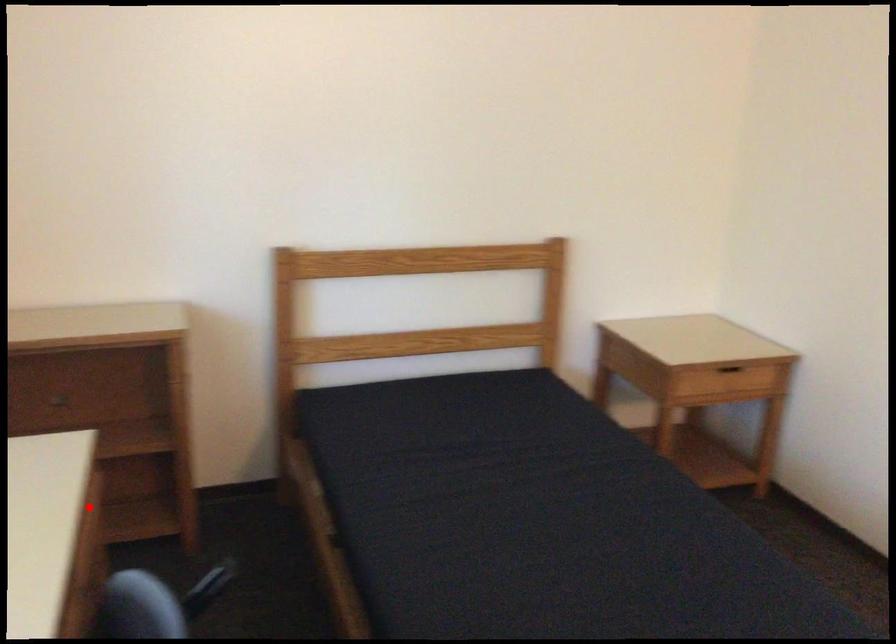
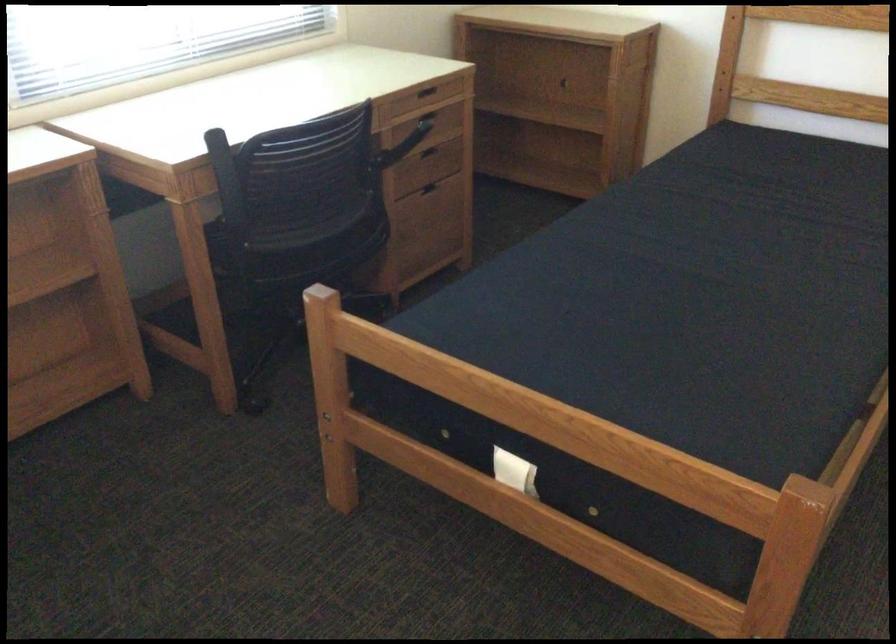
Locate, in the second image, the point that corresponds to the highlighted location in the first image.

(424, 91)